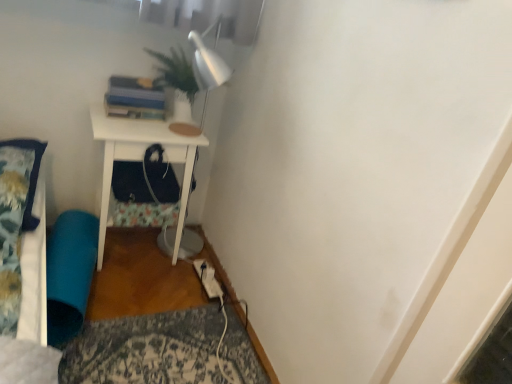
Question: In terms of width, does teal fabric bean bag at lower left look wider or thinner when compared to white matte nightstand at center?

Choices:
 (A) thin
 (B) wide

Answer: (A)

Question: From a real-world perspective, is teal fabric bean bag at lower left physically located above or below white matte nightstand at center?

Choices:
 (A) above
 (B) below

Answer: (B)

Question: Considering the real-world distances, which object is closest to the fluffy blue pillow at left?

Choices:
 (A) teal fabric bean bag at lower left
 (B) white matte nightstand at center

Answer: (A)

Question: Which object is the closest to the white matte nightstand at center?

Choices:
 (A) fluffy blue pillow at left
 (B) teal fabric bean bag at lower left

Answer: (B)